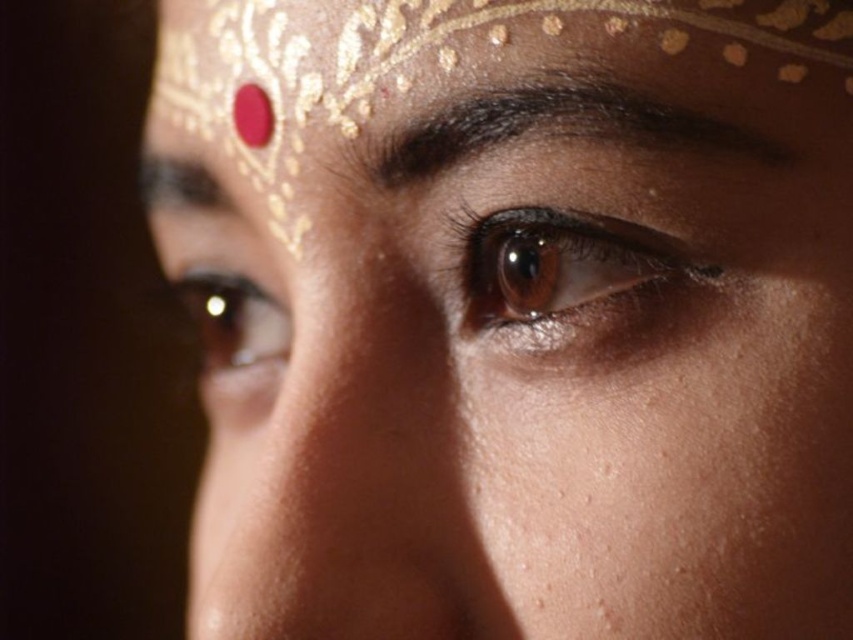
Can you confirm if brown matte eye at center is shorter than brown shiny eye at center?

Yes, brown matte eye at center is shorter than brown shiny eye at center.

Does brown matte eye at center appear over brown shiny eye at center?

Yes, brown matte eye at center is above brown shiny eye at center.

At what (x,y) coordinates should I click in order to perform the action: click on brown matte eye at center. Please return your answer as a coordinate pair (x, y). This screenshot has height=640, width=853. Looking at the image, I should click on (560, 264).

Can you confirm if gold textured forehead at upper center is taller than dark brown hair at upper center?

Correct, gold textured forehead at upper center is much taller as dark brown hair at upper center.

Between gold textured forehead at upper center and dark brown hair at upper center, which one is positioned higher?

gold textured forehead at upper center

This screenshot has height=640, width=853. Find the location of `gold textured forehead at upper center`. gold textured forehead at upper center is located at coordinates (434, 44).

Does dark brown hair at upper center appear under brown matte eye at center?

No.

Does dark brown hair at upper center have a larger size compared to brown matte eye at center?

Correct, dark brown hair at upper center is larger in size than brown matte eye at center.

This screenshot has height=640, width=853. Describe the element at coordinates (569, 122) in the screenshot. I see `dark brown hair at upper center` at that location.

Identify the location of dark brown hair at upper center. (569, 122).